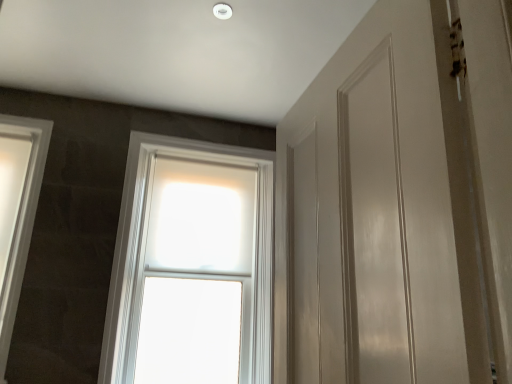
Question: Is white frosted glass window at center, the first window from the right, inside the boundaries of white glossy window at left, which is the 1th window from left to right, or outside?

Choices:
 (A) outside
 (B) inside

Answer: (A)

Question: Would you say white frosted glass window at center, the first window from the right, is to the left or to the right of white glossy window at left, which is counted as the second window, starting from the right, in the picture?

Choices:
 (A) left
 (B) right

Answer: (B)

Question: Is point (138, 278) closer or farther from the camera than point (30, 208)?

Choices:
 (A) closer
 (B) farther

Answer: (B)

Question: From a real-world perspective, relative to white frosted glass window at center, which is the second window from left to right, is white glossy window at left, which is counted as the second window, starting from the right, vertically above or below?

Choices:
 (A) above
 (B) below

Answer: (A)

Question: Does point (19, 213) appear closer or farther from the camera than point (224, 155)?

Choices:
 (A) farther
 (B) closer

Answer: (B)

Question: In terms of height, does white glossy window at left, which is the 1th window from left to right, look taller or shorter compared to white frosted glass window at center, the first window from the right?

Choices:
 (A) short
 (B) tall

Answer: (A)

Question: Relative to white frosted glass window at center, which is the second window from left to right, is white glossy window at left, which is the 1th window from left to right, in front or behind?

Choices:
 (A) front
 (B) behind

Answer: (A)